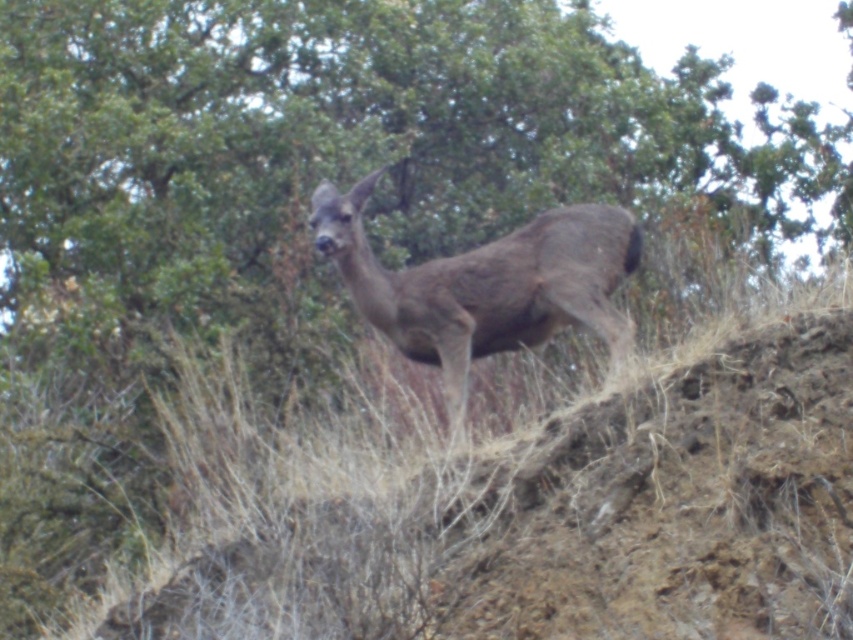
Is green leafy tree at upper center taller than brown fur deer at center?

Yes, green leafy tree at upper center is taller than brown fur deer at center.

Does point (659, 122) come farther from viewer compared to point (430, 340)?

That is True.

This screenshot has height=640, width=853. Describe the element at coordinates (341, 160) in the screenshot. I see `green leafy tree at upper center` at that location.

Where is `green leafy tree at upper center`? The height and width of the screenshot is (640, 853). green leafy tree at upper center is located at coordinates (341, 160).